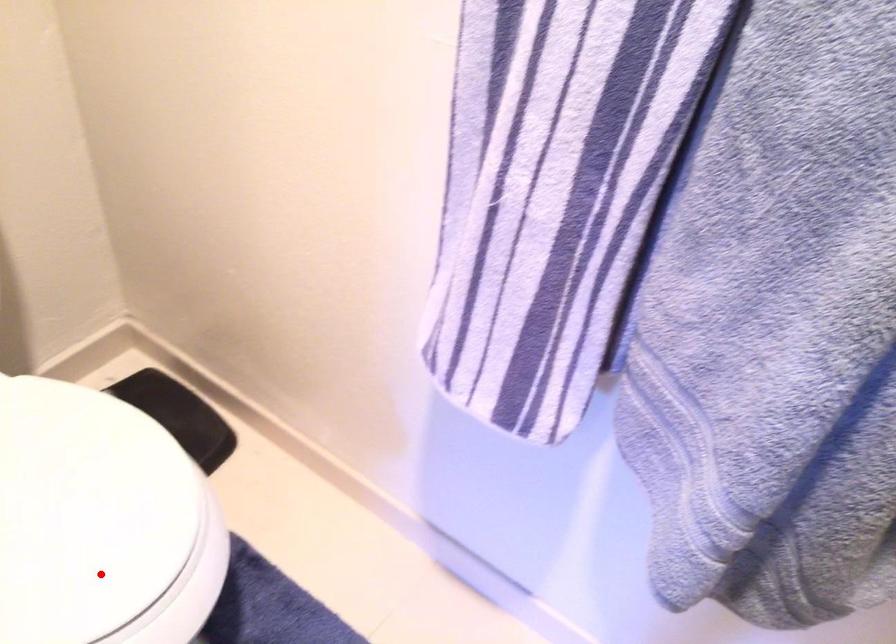
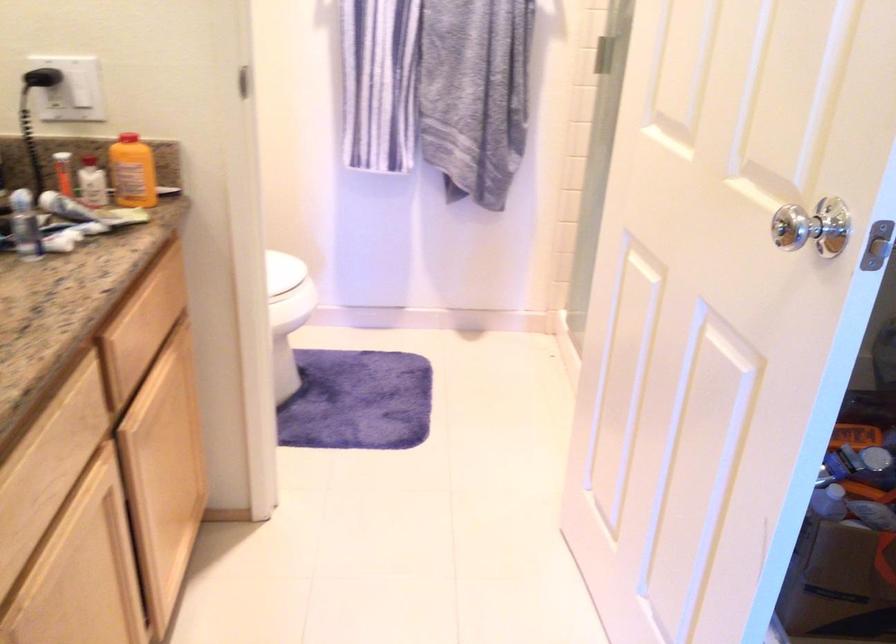
Where in the second image is the point corresponding to the highlighted location from the first image?

(282, 270)